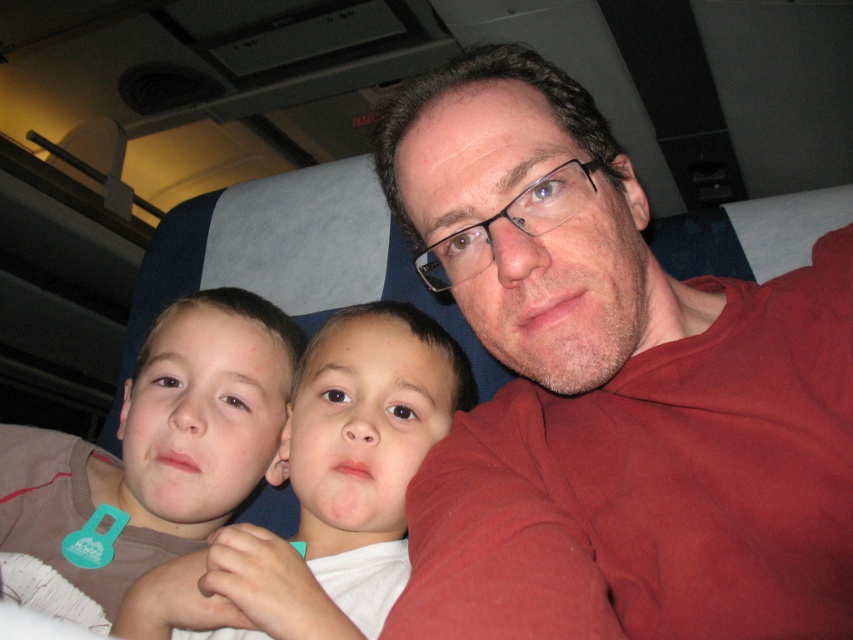
Question: Is brown fabric shirt at left closer to camera compared to brown cotton shirt at left?

Choices:
 (A) no
 (B) yes

Answer: (A)

Question: Considering the real-world distances, which object is closest to the brown cotton shirt at left?

Choices:
 (A) brown fabric shirt at left
 (B) matte red shirt at center

Answer: (A)

Question: Which object appears closest to the camera in this image?

Choices:
 (A) brown cotton shirt at left
 (B) brown fabric shirt at left
 (C) matte red shirt at center

Answer: (C)

Question: Which of these objects is positioned closest to the matte red shirt at center?

Choices:
 (A) brown fabric shirt at left
 (B) brown cotton shirt at left

Answer: (B)

Question: Can you confirm if matte red shirt at center is positioned to the right of brown fabric shirt at left?

Choices:
 (A) no
 (B) yes

Answer: (B)

Question: Can you confirm if matte red shirt at center is wider than brown fabric shirt at left?

Choices:
 (A) no
 (B) yes

Answer: (B)